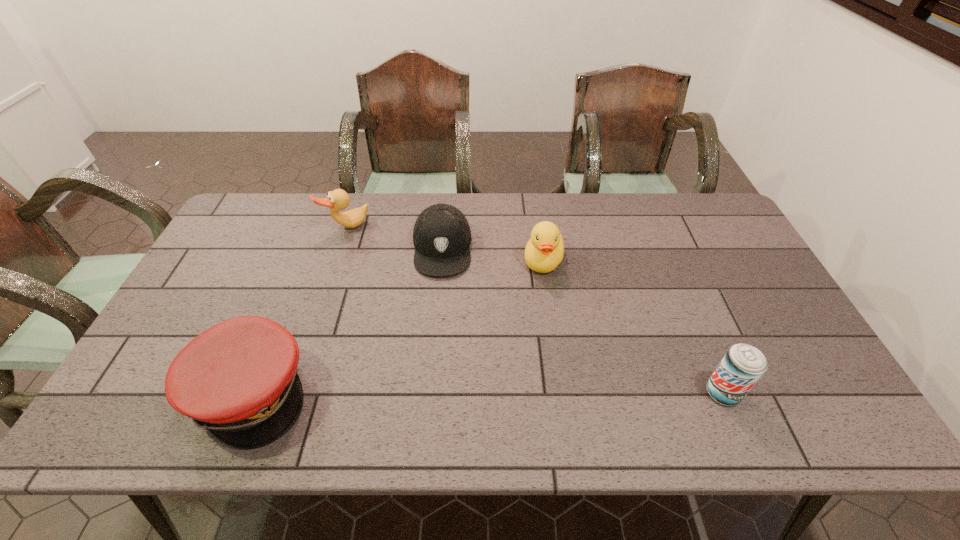
Identify the location of vacant space on the desktop that is between the nearer cap and the rightmost object and is positioned at the beak of the right duck. (498, 393).

Image resolution: width=960 pixels, height=540 pixels. In order to click on free space on the desktop that is between the nearer cap and the beer can and is positioned on the front-facing side of the right cap in this screenshot , I will do `click(435, 393)`.

I want to click on free space on the desktop that is between the left cap and the beer can and is positioned on the beak of the farther duck, so click(x=441, y=393).